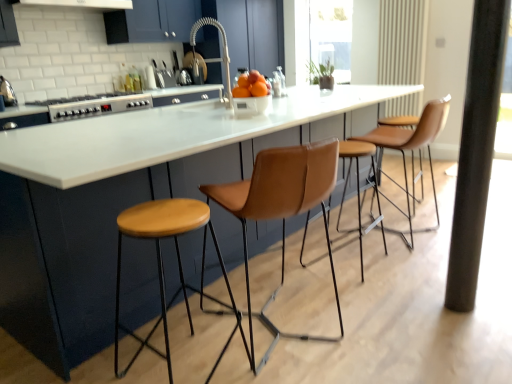
At what (x,y) coordinates should I click in order to perform the action: click on vacant area located to the right-hand side of black matte pillar at right. Please return your answer as a coordinate pair (x, y). Image resolution: width=512 pixels, height=384 pixels. Looking at the image, I should click on (492, 297).